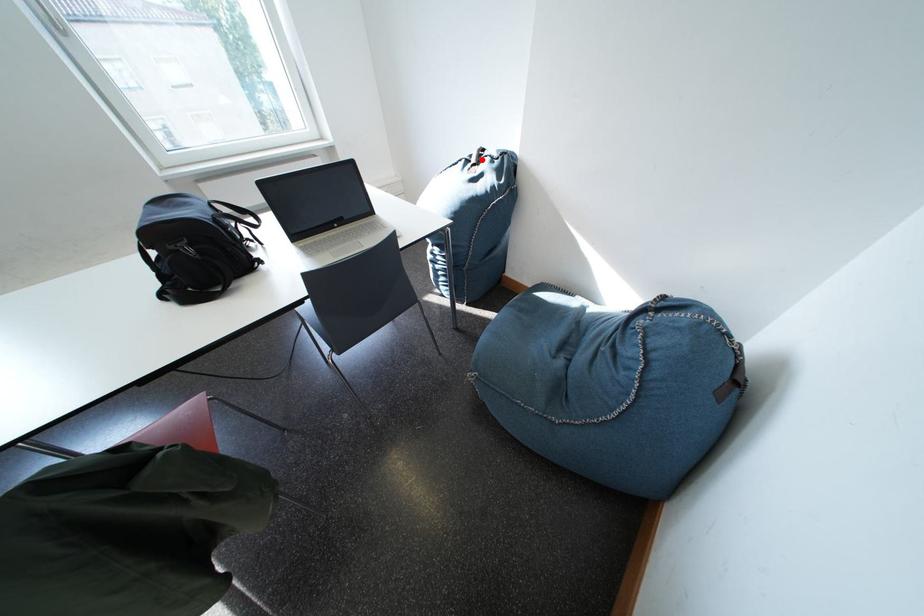
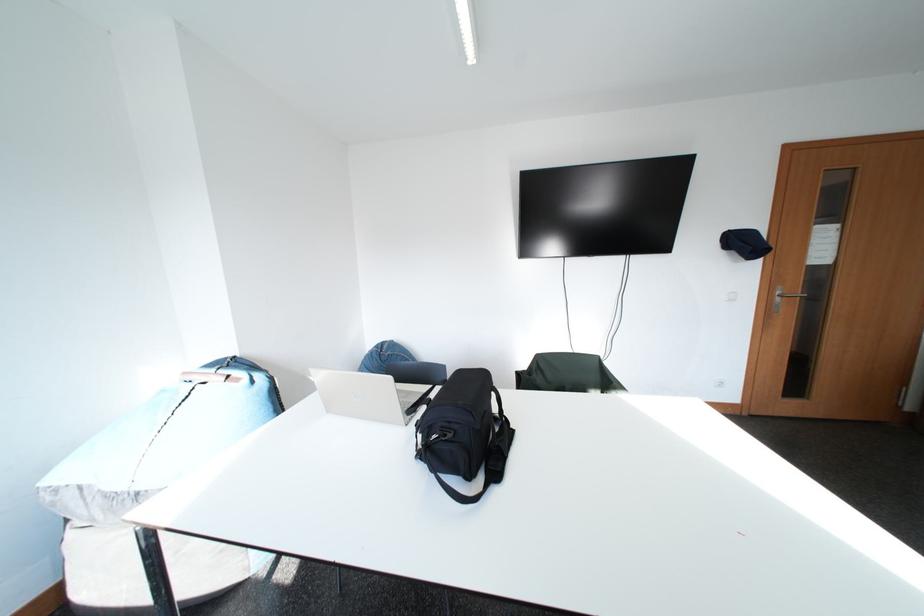
Question: I am providing you with two images of the same scene from different viewpoints. A red point is marked on the first image. At the location where the point appears in image 1, is it still visible in image 2?

Choices:
 (A) Yes
 (B) No

Answer: (B)